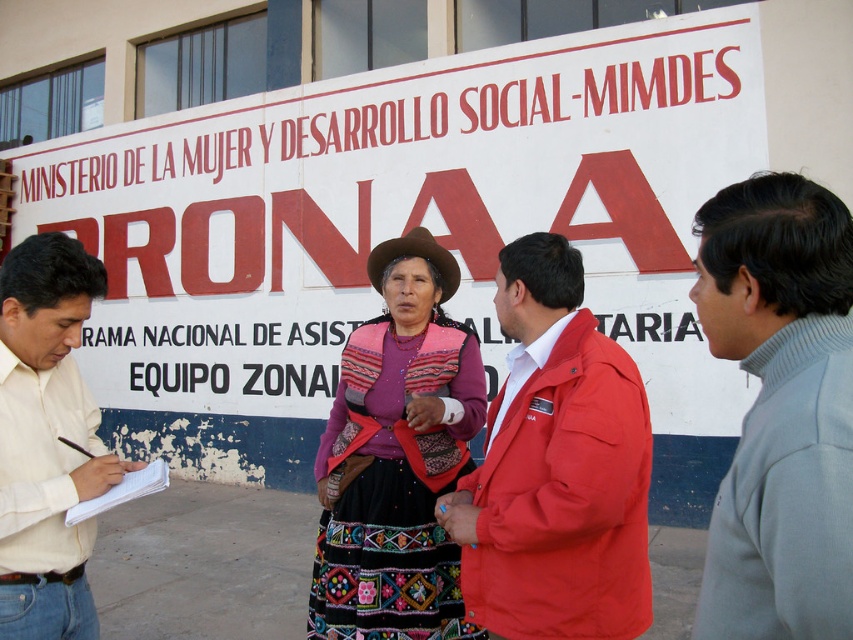
You are a photographer who needs to capture a clear photo of both the gray turtleneck sweater at right and the brown felt cowboy hat at center. Since you want both objects to appear equally tall in the photo, which adjustment should you make?

The gray turtleneck sweater at right is taller than the brown felt cowboy hat at center. To make them appear equally tall in the photo, you should move closer to the brown felt cowboy hat at center or farther from the gray turtleneck sweater at right.